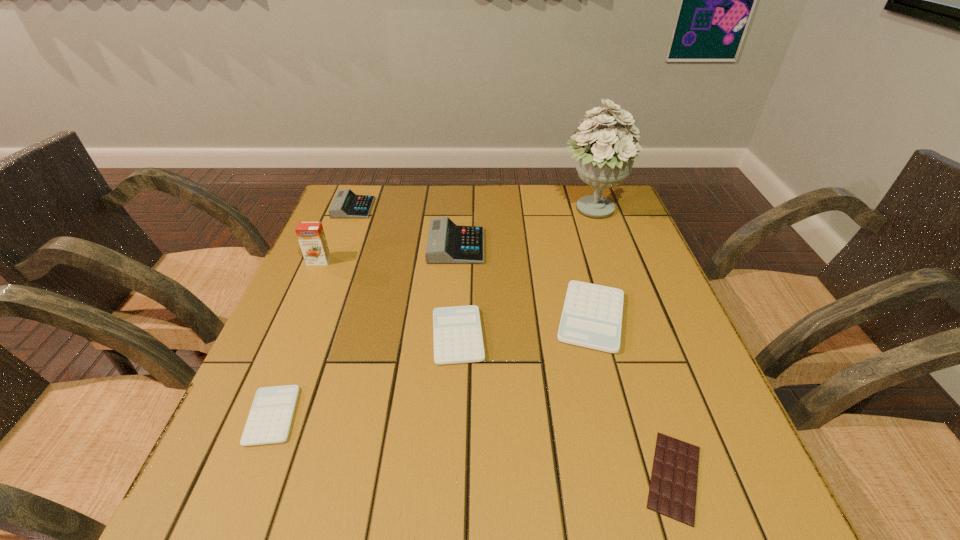
Identify the location of blank area located on the back of the rightmost calculator. [x=570, y=234].

Find the location of a particular element. The width and height of the screenshot is (960, 540). vacant region located on the right of the second smallest white calculator is located at coordinates (606, 335).

Identify the location of free region located on the back of the nearest white calculator. This screenshot has height=540, width=960. (330, 271).

The height and width of the screenshot is (540, 960). I want to click on vacant space situated 0.270m on the back of the brown chocolate bar, so click(623, 321).

Locate an element on the screen. The image size is (960, 540). bouquet located at the far edge is located at coordinates (604, 159).

At what (x,y) coordinates should I click in order to perform the action: click on calculator at the far edge. Please return your answer as a coordinate pair (x, y). Looking at the image, I should click on (346, 204).

Locate an element on the screen. The image size is (960, 540). object situated at the near edge is located at coordinates (673, 486).

Find the location of `orange juice at the left edge`. orange juice at the left edge is located at coordinates tap(311, 236).

This screenshot has height=540, width=960. I want to click on bouquet positioned at the right edge, so click(x=604, y=159).

The width and height of the screenshot is (960, 540). I want to click on calculator located in the right edge section of the desktop, so pos(592,314).